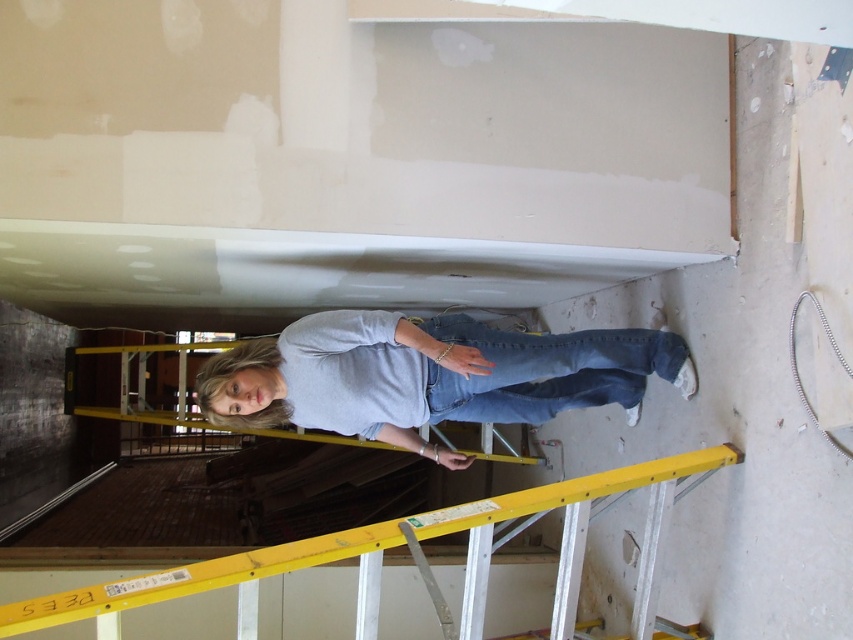
You are a safety inspector checking the construction site. You see the light gray cotton shirt at center. According to safety regulations, workers must be at least 2.5 meters away from the camera for privacy. Is the worker compliant with this rule?

The distance between the light gray cotton shirt at center and the camera is 2.32 meters, which is less than the required 2.5 meters. Therefore, the worker is not compliant with the privacy regulation.

You are a contractor assessing the workspace safety. You see the yellow metallic ladder at center and the denim at center. Which object takes up more space in the scene?

The yellow metallic ladder at center is bigger than denim at center, so it takes up more space in the scene.